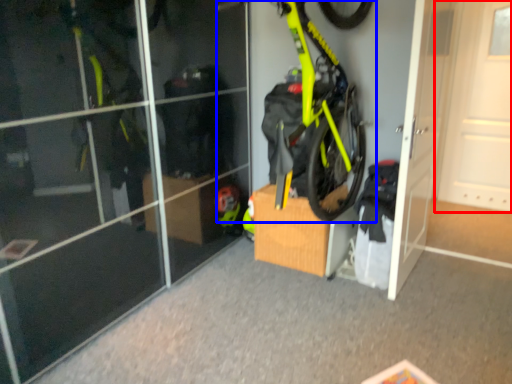
Question: Among these objects, which one is farthest to the camera, door (highlighted by a red box) or bicycle (highlighted by a blue box)?

Choices:
 (A) door
 (B) bicycle

Answer: (A)